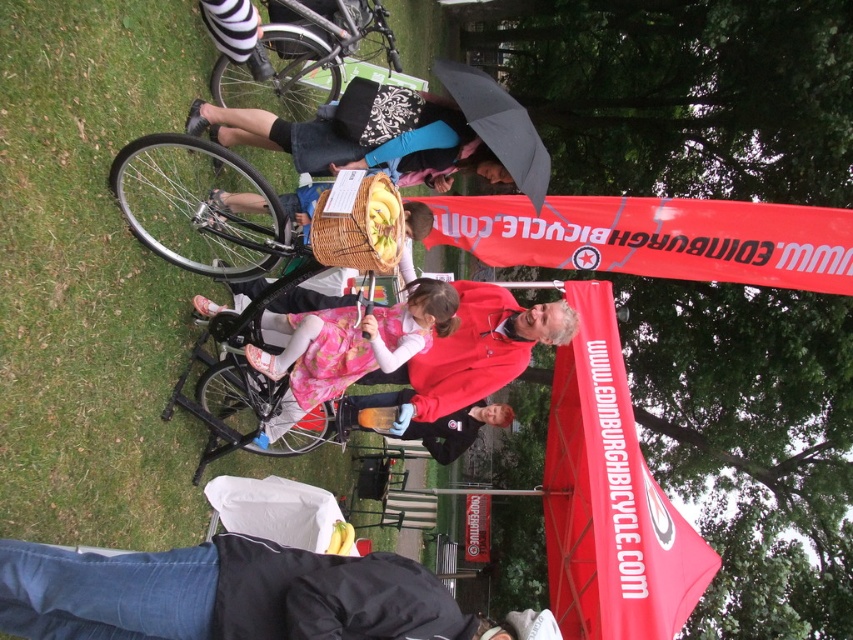
Question: Which point is farther to the camera?

Choices:
 (A) black matte bicycle at upper left
 (B) red fabric banner at upper center
 (C) dark brown leather jacket at center

Answer: (C)

Question: Can you confirm if red fabric banner at upper center is bigger than matte pink dress at center?

Choices:
 (A) no
 (B) yes

Answer: (A)

Question: Which object is positioned farthest from the matte pink dress at center?

Choices:
 (A) black matte umbrella at upper center
 (B) red fabric canopy at center
 (C) silver metallic bicycle at upper center

Answer: (C)

Question: Which of the following is the farthest from the observer?

Choices:
 (A) red fabric banner at upper center
 (B) silver metallic bicycle at upper center

Answer: (A)

Question: Is red fabric banner at upper center smaller than black matte umbrella at upper center?

Choices:
 (A) no
 (B) yes

Answer: (A)

Question: Does red fabric banner at upper center come in front of matte pink dress at center?

Choices:
 (A) no
 (B) yes

Answer: (A)